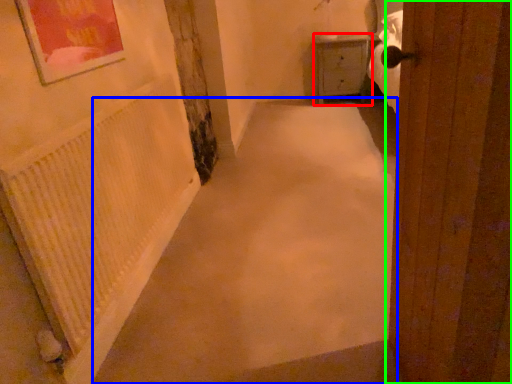
Question: Which object is positioned farthest from furniture (highlighted by a red box)? Select from alley (highlighted by a blue box) and door (highlighted by a green box).

Choices:
 (A) alley
 (B) door

Answer: (B)